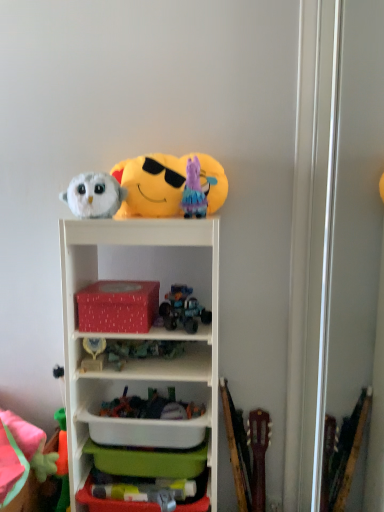
Question: Can you confirm if fluffy pink plush at lower left, positioned as the first toy in bottom-to-top order, is shorter than soft plush emoji at upper center, which appears as the 1th toy when viewed from the top?

Choices:
 (A) yes
 (B) no

Answer: (A)

Question: Is fluffy pink plush at lower left, marked as the seventh toy in a top-to-bottom arrangement, at the right side of soft plush emoji at upper center, which appears as the 1th toy when viewed from the top?

Choices:
 (A) no
 (B) yes

Answer: (A)

Question: Is fluffy pink plush at lower left, positioned as the first toy in bottom-to-top order, positioned with its back to soft plush emoji at upper center, the 7th toy when ordered from bottom to top?

Choices:
 (A) yes
 (B) no

Answer: (B)

Question: From the image's perspective, is fluffy pink plush at lower left, marked as the seventh toy in a top-to-bottom arrangement, on top of soft plush emoji at upper center, the 7th toy when ordered from bottom to top?

Choices:
 (A) yes
 (B) no

Answer: (B)

Question: Is fluffy pink plush at lower left, positioned as the first toy in bottom-to-top order, positioned before soft plush emoji at upper center, the 7th toy when ordered from bottom to top?

Choices:
 (A) yes
 (B) no

Answer: (B)

Question: Is translucent plastic toy at center, positioned as the sixth toy in top-to-bottom order, facing away from white plastic shelf at center?

Choices:
 (A) no
 (B) yes

Answer: (B)

Question: Can you confirm if translucent plastic toy at center, positioned as the sixth toy in top-to-bottom order, is smaller than white plastic shelf at center?

Choices:
 (A) no
 (B) yes

Answer: (B)

Question: From the image's perspective, is translucent plastic toy at center, positioned as the sixth toy in top-to-bottom order, located beneath white plastic shelf at center?

Choices:
 (A) no
 (B) yes

Answer: (A)

Question: Is translucent plastic toy at center, arranged as the 2th toy when ordered from the bottom, facing towards white plastic shelf at center?

Choices:
 (A) no
 (B) yes

Answer: (B)

Question: Is translucent plastic toy at center, positioned as the sixth toy in top-to-bottom order, beside white plastic shelf at center?

Choices:
 (A) no
 (B) yes

Answer: (A)

Question: Is white plastic shelf at center inside translucent plastic toy at center, arranged as the 2th toy when ordered from the bottom?

Choices:
 (A) yes
 (B) no

Answer: (B)

Question: Can you confirm if soft plush emoji at upper center, the 7th toy when ordered from bottom to top, is positioned to the right of red matte tissue box at center, the 1th storage box positioned from the top?

Choices:
 (A) yes
 (B) no

Answer: (A)